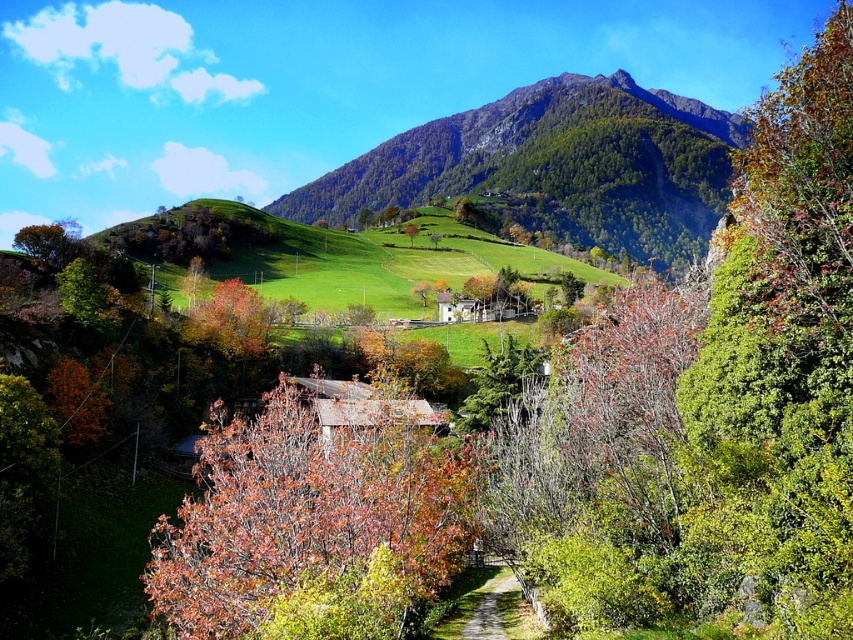
Question: Does green grassy hillside at center appear over green leafy tree at center?

Choices:
 (A) no
 (B) yes

Answer: (B)

Question: Can you confirm if brown matte tree at center is thinner than green grassy path at center?

Choices:
 (A) no
 (B) yes

Answer: (A)

Question: Considering the real-world distances, which object is closest to the green grassy hillside at center?

Choices:
 (A) orange matte tree at lower left
 (B) brown matte tree at center
 (C) green grassy path at center

Answer: (A)

Question: Among these objects, which one is nearest to the camera?

Choices:
 (A) green grassy hillside at center
 (B) brown matte tree at center

Answer: (B)

Question: Is green grassy hillside at center further to the viewer compared to green grassy path at center?

Choices:
 (A) yes
 (B) no

Answer: (A)

Question: Which of the following is the farthest from the observer?

Choices:
 (A) orange matte tree at lower left
 (B) green leafy tree at center

Answer: (B)